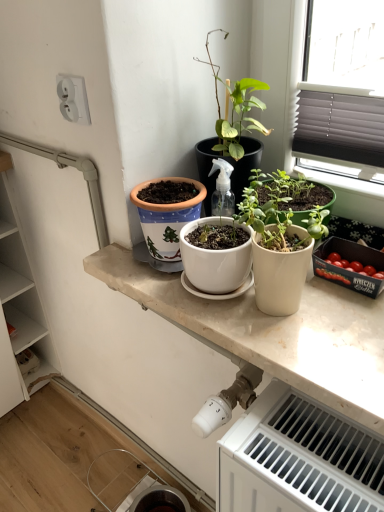
What do you see at coordinates (73, 98) in the screenshot?
I see `white plastic socket at upper left` at bounding box center [73, 98].

What do you see at coordinates (167, 216) in the screenshot? The width and height of the screenshot is (384, 512). I see `terracotta clay pot at center` at bounding box center [167, 216].

The width and height of the screenshot is (384, 512). I want to click on white matte pot at center, so click(279, 240).

Image resolution: width=384 pixels, height=512 pixels. What do you see at coordinates (278, 281) in the screenshot? I see `green matte plant at center` at bounding box center [278, 281].

What are the coordinates of `white plastic socket at upper left` in the screenshot? It's located at [73, 98].

From the image's perspective, between white matte pot at center and white plastic radiator at lower right, who is located below?

From the image's view, white plastic radiator at lower right is below.

From a real-world perspective, is white matte pot at center positioned above or below white plastic radiator at lower right?

In terms of real-world spatial position, white matte pot at center is above white plastic radiator at lower right.

The image size is (384, 512). In order to click on houseplant that is above the white plastic radiator at lower right (from a real-world perspective) in this screenshot , I will do pos(279,240).

Would you consider white matte pot at center to be distant from white plastic radiator at lower right?

No, white matte pot at center is in close proximity to white plastic radiator at lower right.

Is terracotta clay pot at center to the left of white matte cabinet at left from the viewer's perspective?

In fact, terracotta clay pot at center is to the right of white matte cabinet at left.

Is terracotta clay pot at center aimed at white matte cabinet at left?

No, terracotta clay pot at center does not turn towards white matte cabinet at left.

Which object is more forward, terracotta clay pot at center or white matte cabinet at left?

terracotta clay pot at center is closer to the camera.

The width and height of the screenshot is (384, 512). Identify the location of flowerpot in front of the white matte cabinet at left. (167, 216).

Is white plastic radiator at lower right located within white plastic socket at upper left?

Definitely not — white plastic radiator at lower right is not inside white plastic socket at upper left.

From a real-world perspective, is white plastic socket at upper left positioned over white plastic radiator at lower right based on gravity?

Yes, from a real-world perspective, white plastic socket at upper left is above white plastic radiator at lower right.

From the image's perspective, does white plastic socket at upper left appear lower than white plastic radiator at lower right?

→ No, from the image's perspective, white plastic socket at upper left is not beneath white plastic radiator at lower right.

Does point (82, 81) come closer to viewer compared to point (269, 452)?

That is False.

From a real-world perspective, is white plastic radiator at lower right located beneath white plastic socket at upper left?

Yes, from a real-world perspective, white plastic radiator at lower right is below white plastic socket at upper left.

Can you confirm if white plastic radiator at lower right is taller than white plastic socket at upper left?

Yes, white plastic radiator at lower right is taller than white plastic socket at upper left.

Consider the image. Are white plastic radiator at lower right and white plastic socket at upper left far apart?

white plastic radiator at lower right is actually quite close to white plastic socket at upper left.

Is green matte plant at center beside white plastic socket at upper left?

No, green matte plant at center is not beside white plastic socket at upper left.

From the image's perspective, is green matte plant at center on white plastic socket at upper left?

No, from the image's perspective, green matte plant at center is not above white plastic socket at upper left.

What's the angular difference between green matte plant at center and white plastic socket at upper left's facing directions?

The angular difference between green matte plant at center and white plastic socket at upper left is 3.01 degrees.

Would you say green matte plant at center is to the left or to the right of white plastic socket at upper left in the picture?

green matte plant at center is to the right of white plastic socket at upper left.

Does white glossy countertop at center turn towards white matte cabinet at left?

No, white glossy countertop at center is not oriented towards white matte cabinet at left.

Considering the positions of objects white glossy countertop at center and white matte cabinet at left in the image provided, who is more to the right, white glossy countertop at center or white matte cabinet at left?

white glossy countertop at center is more to the right.

Does white glossy countertop at center have a lesser width compared to white matte cabinet at left?

Yes, white glossy countertop at center is thinner than white matte cabinet at left.

Is white glossy countertop at center shorter than white matte cabinet at left?

Indeed, white glossy countertop at center has a lesser height compared to white matte cabinet at left.

Is white matte cabinet at left smaller than white plastic radiator at lower right?

Incorrect, white matte cabinet at left is not smaller in size than white plastic radiator at lower right.

Is white matte cabinet at left at the left side of white plastic radiator at lower right?

Correct, you'll find white matte cabinet at left to the left of white plastic radiator at lower right.

Where is `cabinetry above the white plastic radiator at lower right (from a real-world perspective)`? The image size is (384, 512). cabinetry above the white plastic radiator at lower right (from a real-world perspective) is located at coordinates (22, 290).

Locate an element on the screen. The width and height of the screenshot is (384, 512). radiator lying in front of the white matte pot at center is located at coordinates (299, 459).

This screenshot has width=384, height=512. What are the coordinates of `flowerpot that appears on the right of white matte cabinet at left` in the screenshot? It's located at [x=167, y=216].

Estimate the real-world distances between objects in this image. Which object is further from white glossy countertop at center, white matte cabinet at left or terracotta clay pot at center?

Among the two, white matte cabinet at left is located further to white glossy countertop at center.

When comparing their distances from green matte plant at center, does terracotta clay pot at center or white plastic socket at upper left seem closer?

The object closer to green matte plant at center is terracotta clay pot at center.

Which object lies nearer to the anchor point white plastic socket at upper left, white matte cabinet at left or white glossy countertop at center?

white glossy countertop at center lies closer to white plastic socket at upper left than the other object.

From the image, which object appears to be nearer to white glossy countertop at center, white plastic radiator at lower right or white matte pot at center?

white matte pot at center is positioned closer to the anchor white glossy countertop at center.

Consider the image. Considering their positions, is white matte cabinet at left positioned closer to white glossy countertop at center than green matte plant at center?

Among the two, green matte plant at center is located nearer to white glossy countertop at center.

From the image, which object appears to be farther from white plastic socket at upper left, green matte plant at center or white matte pot at center?

Based on the image, white matte pot at center appears to be further to white plastic socket at upper left.

In the scene shown: Which object lies nearer to the anchor point white glossy countertop at center, white plastic radiator at lower right or white plastic socket at upper left?

Among the two, white plastic radiator at lower right is located nearer to white glossy countertop at center.

Based on the photo, considering their positions, is white plastic socket at upper left positioned closer to white plastic radiator at lower right than terracotta clay pot at center?

Based on the image, terracotta clay pot at center appears to be nearer to white plastic radiator at lower right.

Image resolution: width=384 pixels, height=512 pixels. I want to click on countertop situated between white matte cabinet at left and white plastic radiator at lower right from left to right, so click(274, 333).

I want to click on flowerpot between green matte plant at center and white matte pot at center vertically, so click(167, 216).

Identify the location of flowerpot located between white plastic socket at upper left and white glossy countertop at center in the left-right direction. This screenshot has height=512, width=384. (167, 216).

Locate an element on the screen. The width and height of the screenshot is (384, 512). vegetable garden between white plastic socket at upper left and white glossy countertop at center from left to right is located at coordinates click(x=278, y=281).